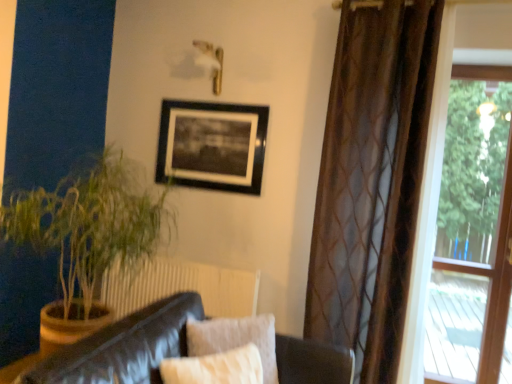
Question: Looking at their shapes, would you say transparent glass window at right is wider or thinner than black matte picture frame at upper center?

Choices:
 (A) wide
 (B) thin

Answer: (A)

Question: Do you think transparent glass window at right is within black matte picture frame at upper center, or outside of it?

Choices:
 (A) inside
 (B) outside

Answer: (B)

Question: Which object is the farthest from the brown sheer curtain at right?

Choices:
 (A) green leafy plant at left
 (B) transparent glass window at right
 (C) leather couch at lower left
 (D) black matte picture frame at upper center

Answer: (B)

Question: Considering the real-world distances, which object is farthest from the transparent glass window at right?

Choices:
 (A) black matte picture frame at upper center
 (B) leather couch at lower left
 (C) green leafy plant at left
 (D) brown sheer curtain at right

Answer: (B)